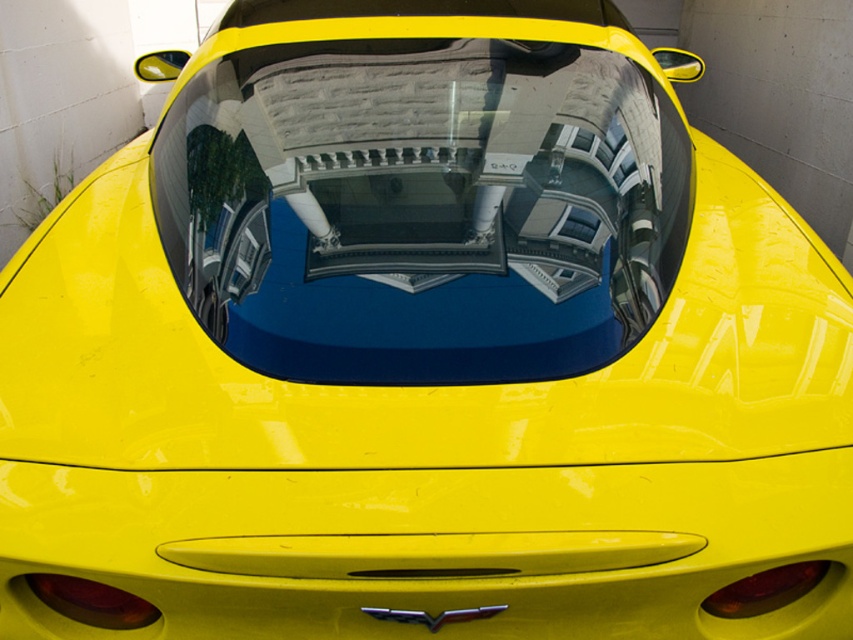
Question: Is transparent glass windshield at center smaller than white plastic license plate at center?

Choices:
 (A) yes
 (B) no

Answer: (B)

Question: Does transparent glass windshield at center appear on the left side of white plastic license plate at center?

Choices:
 (A) no
 (B) yes

Answer: (B)

Question: Among these objects, which one is farthest from the camera?

Choices:
 (A) white plastic license plate at center
 (B) transparent glass windshield at center

Answer: (A)

Question: Can you confirm if transparent glass windshield at center is positioned above white plastic license plate at center?

Choices:
 (A) yes
 (B) no

Answer: (B)